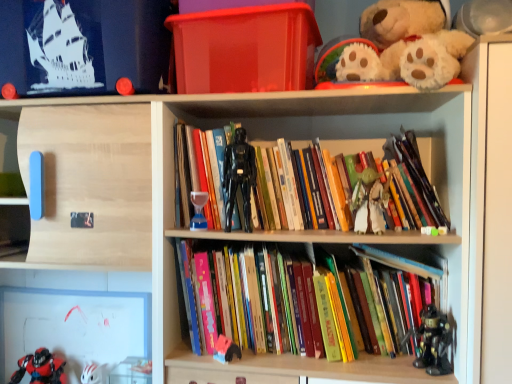
Question: Choose the correct answer: Is black plastic action figure at center, which is the seventh toy from bottom to top, inside transparent plastic box at upper center or outside it?

Choices:
 (A) outside
 (B) inside

Answer: (A)

Question: Considering the positions of point (231, 142) and point (256, 74), is point (231, 142) closer or farther from the camera than point (256, 74)?

Choices:
 (A) farther
 (B) closer

Answer: (A)

Question: Estimate the real-world distances between objects in this image. Which object is closer to the white matte helmet at lower left, which ranks as the 2th toy in bottom-to-top order?

Choices:
 (A) wooden books at center
 (B) transparent plastic box at upper center
 (C) hardcover books at center, the 2th book viewed from the top
 (D) translucent glass hourglass at center, placed as the 5th toy when sorted from right to left
 (E) metallic black robot at lower right, the 1th toy from the right

Answer: (D)

Question: Estimate the real-world distances between objects in this image. Which object is closer to the wooden books at center?

Choices:
 (A) hardcover books at center, the second book positioned from the bottom
 (B) black plastic action figure at center, positioned as the 3th toy in right-to-left order
 (C) shiny red plastic toy at lower left, which is counted as the seventh toy, starting from the top
 (D) translucent glass hourglass at center, placed as the 3th toy when sorted from top to bottom
 (E) metallic black robot at lower right, the seventh toy viewed from the left

Answer: (A)